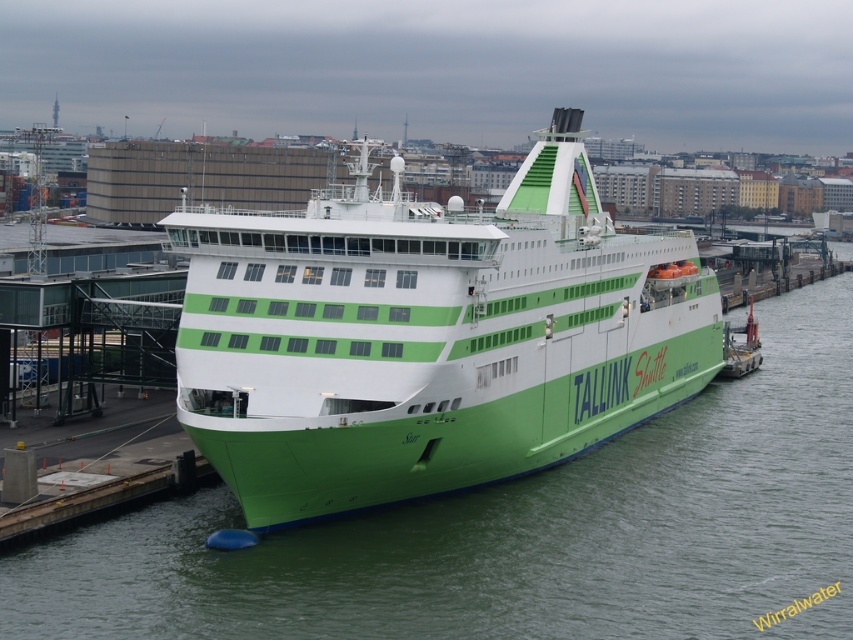
Does green matte ship at center appear over green matte water at center?

Indeed, green matte ship at center is positioned over green matte water at center.

Is point (198, 330) positioned before point (160, 596)?

That is False.

Identify the location of green matte ship at center. The height and width of the screenshot is (640, 853). [x=428, y=337].

Find the location of a particular element. The height and width of the screenshot is (640, 853). green matte ship at center is located at coordinates (428, 337).